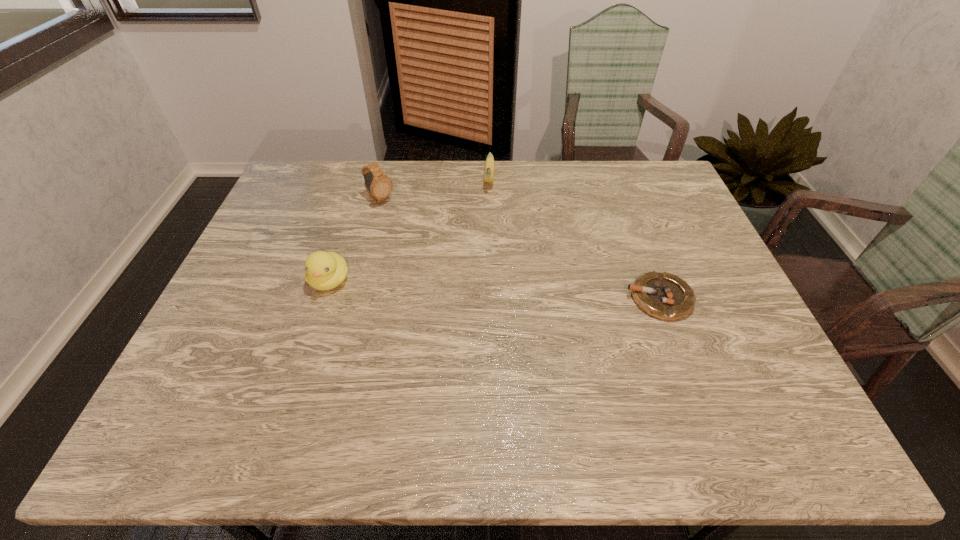
What are the coordinates of `free space between the duckling and the banana` in the screenshot? It's located at (409, 230).

In order to click on vacant area that lies between the watch and the shortest object in this screenshot , I will do `click(519, 249)`.

Where is `empty location between the banana and the duckling`? The image size is (960, 540). empty location between the banana and the duckling is located at coordinates (409, 230).

Identify which object is located as the second nearest to the watch. Please provide its 2D coordinates. Your answer should be formatted as a tuple, i.e. [(x, y)], where the tuple contains the x and y coordinates of a point satisfying the conditions above.

[(489, 165)]

This screenshot has height=540, width=960. I want to click on object that is the closest to the third tallest object, so click(379, 187).

I want to click on free space that satisfies the following two spatial constraints: 1. on the front side of the rightmost object; 2. on the right side of the third tallest object, so click(492, 298).

The height and width of the screenshot is (540, 960). Identify the location of vacant area that satisfies the following two spatial constraints: 1. on the front side of the watch; 2. on the right side of the shortest object. point(354,298).

At what (x,y) coordinates should I click in order to perform the action: click on free spot that satisfies the following two spatial constraints: 1. on the back side of the watch; 2. on the left side of the banana. Please return your answer as a coordinate pair (x, y). The height and width of the screenshot is (540, 960). Looking at the image, I should click on pos(385,180).

Identify the location of free space that satisfies the following two spatial constraints: 1. at the beak of the duckling; 2. on the left side of the ashtray. (324, 298).